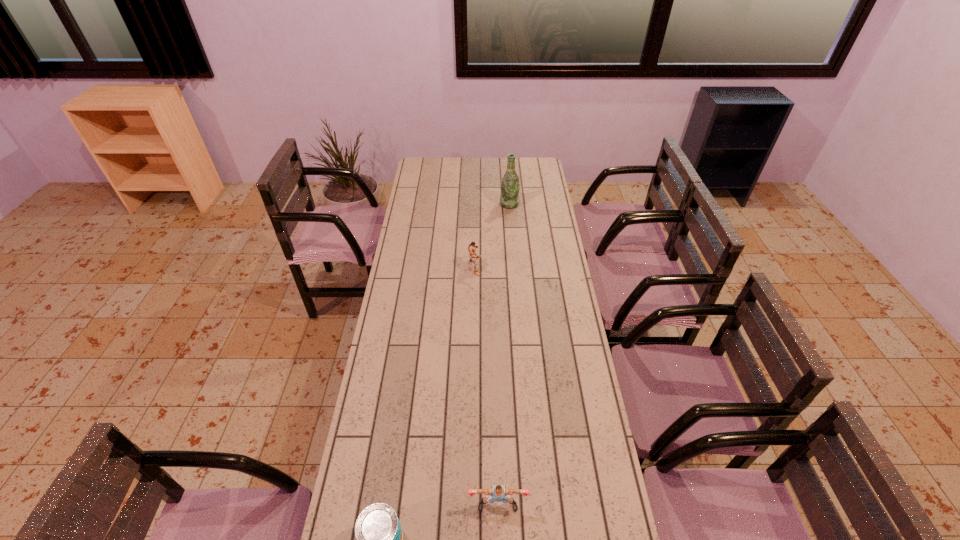
Where is `vacant space at the far left corner of the desktop`? The image size is (960, 540). vacant space at the far left corner of the desktop is located at coordinates (420, 174).

At what (x,y) coordinates should I click in order to perform the action: click on blank space at the far right corner. Please return your answer as a coordinate pair (x, y). This screenshot has width=960, height=540. Looking at the image, I should click on (531, 173).

Find the location of `free space between the second farthest object and the tallest object`. free space between the second farthest object and the tallest object is located at coordinates (x=492, y=236).

Identify the location of free space that is in between the beer bottle and the farther puncher. The image size is (960, 540). (492, 236).

The image size is (960, 540). I want to click on empty space that is in between the beer bottle and the nearer puncher, so click(504, 355).

The width and height of the screenshot is (960, 540). Find the location of `free space between the second nearest object and the farthest object`. free space between the second nearest object and the farthest object is located at coordinates (504, 355).

Where is `empty space that is in between the farther puncher and the nearer puncher`? This screenshot has height=540, width=960. empty space that is in between the farther puncher and the nearer puncher is located at coordinates (486, 387).

In order to click on free space between the farther puncher and the nearer puncher in this screenshot , I will do `click(486, 387)`.

Locate an element on the screen. object that can be found as the third closest to the nearer puncher is located at coordinates (510, 186).

Identify which object is located as the second nearest to the farther puncher. Please provide its 2D coordinates. Your answer should be formatted as a tuple, i.e. [(x, y)], where the tuple contains the x and y coordinates of a point satisfying the conditions above.

[(499, 493)]